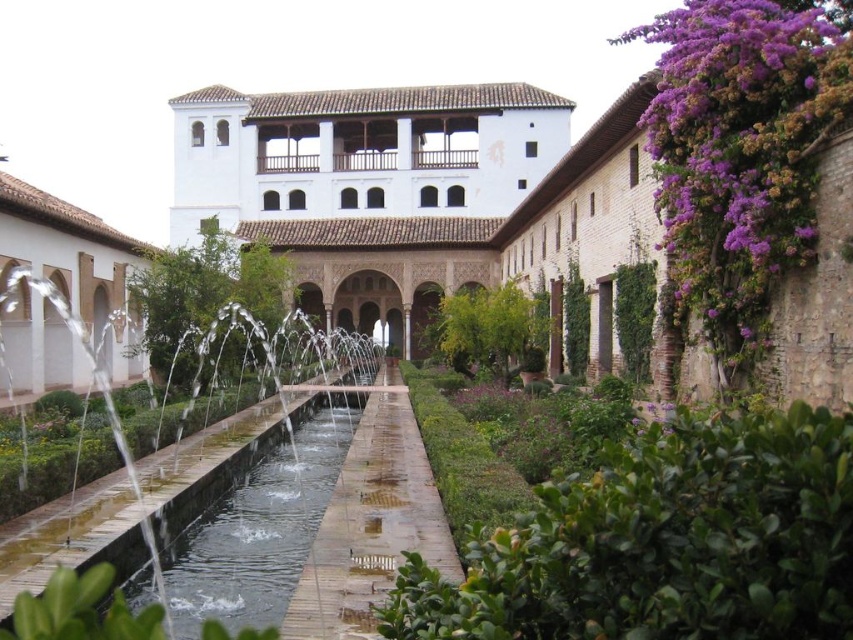
Question: Among these points, which one is farthest from the camera?

Choices:
 (A) (772, 93)
 (B) (175, 522)

Answer: (A)

Question: Is purple textured wall at upper right wider than white stucco palace at left?

Choices:
 (A) no
 (B) yes

Answer: (B)

Question: Which object appears closest to the camera in this image?

Choices:
 (A) clear water at center
 (B) green leafy bush at lower right
 (C) clear glass water at center

Answer: (B)

Question: Is clear water at center above white stucco palace at left?

Choices:
 (A) no
 (B) yes

Answer: (A)

Question: Is purple textured wall at upper right to the left of clear glass water at center from the viewer's perspective?

Choices:
 (A) yes
 (B) no

Answer: (B)

Question: Which of these objects is positioned closest to the purple textured wall at upper right?

Choices:
 (A) green leafy bush at lower right
 (B) white stucco palace at left
 (C) clear glass water at center

Answer: (A)